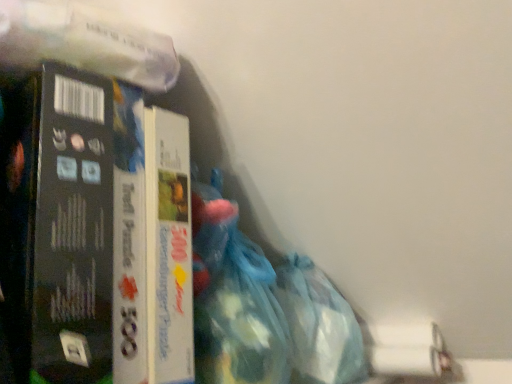
Question: Would you say matte cardboard puzzle box at left is part of translucent blue plastic bag at lower right's contents?

Choices:
 (A) yes
 (B) no

Answer: (B)

Question: Is translucent blue plastic bag at lower right far from matte cardboard puzzle box at left?

Choices:
 (A) yes
 (B) no

Answer: (B)

Question: From the image's perspective, is translucent blue plastic bag at lower right located beneath matte cardboard puzzle box at left?

Choices:
 (A) yes
 (B) no

Answer: (A)

Question: Is translucent blue plastic bag at lower right further to camera compared to matte cardboard puzzle box at left?

Choices:
 (A) yes
 (B) no

Answer: (A)

Question: Considering the relative sizes of translucent blue plastic bag at lower right and matte cardboard puzzle box at left in the image provided, is translucent blue plastic bag at lower right shorter than matte cardboard puzzle box at left?

Choices:
 (A) yes
 (B) no

Answer: (A)

Question: Is point (7, 173) closer or farther from the camera than point (344, 349)?

Choices:
 (A) farther
 (B) closer

Answer: (B)

Question: From a real-world perspective, is matte cardboard puzzle box at left positioned above or below translucent blue plastic bag at lower right?

Choices:
 (A) below
 (B) above

Answer: (B)

Question: From their relative heights in the image, would you say matte cardboard puzzle box at left is taller or shorter than translucent blue plastic bag at lower right?

Choices:
 (A) tall
 (B) short

Answer: (A)

Question: Based on their sizes in the image, would you say matte cardboard puzzle box at left is bigger or smaller than translucent blue plastic bag at lower right?

Choices:
 (A) small
 (B) big

Answer: (B)

Question: Is translucent plastic bag at lower center to the left or to the right of translucent blue plastic bag at lower right in the image?

Choices:
 (A) left
 (B) right

Answer: (A)

Question: Considering their positions, is translucent plastic bag at lower center located in front of or behind translucent blue plastic bag at lower right?

Choices:
 (A) front
 (B) behind

Answer: (A)

Question: From their relative heights in the image, would you say translucent plastic bag at lower center is taller or shorter than translucent blue plastic bag at lower right?

Choices:
 (A) short
 (B) tall

Answer: (B)

Question: Is point (223, 278) positioned closer to the camera than point (296, 321)?

Choices:
 (A) farther
 (B) closer

Answer: (B)

Question: From a real-world perspective, is translucent blue plastic bag at lower right above or below matte cardboard puzzle box at left?

Choices:
 (A) above
 (B) below

Answer: (B)

Question: Is translucent blue plastic bag at lower right spatially inside matte cardboard puzzle box at left, or outside of it?

Choices:
 (A) inside
 (B) outside

Answer: (B)